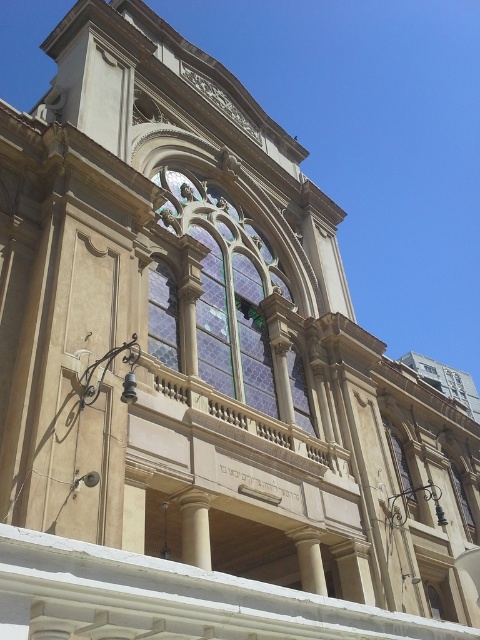
Consider the image. Who is lower down, stained glass window at center or stained glass window at upper center?

Positioned lower is stained glass window at upper center.

Between stained glass window at center and stained glass window at upper center, which one has more height?

stained glass window at center

Is point (219, 333) positioned in front of point (154, 333)?

That is False.

Identify the location of stained glass window at center. [227, 289].